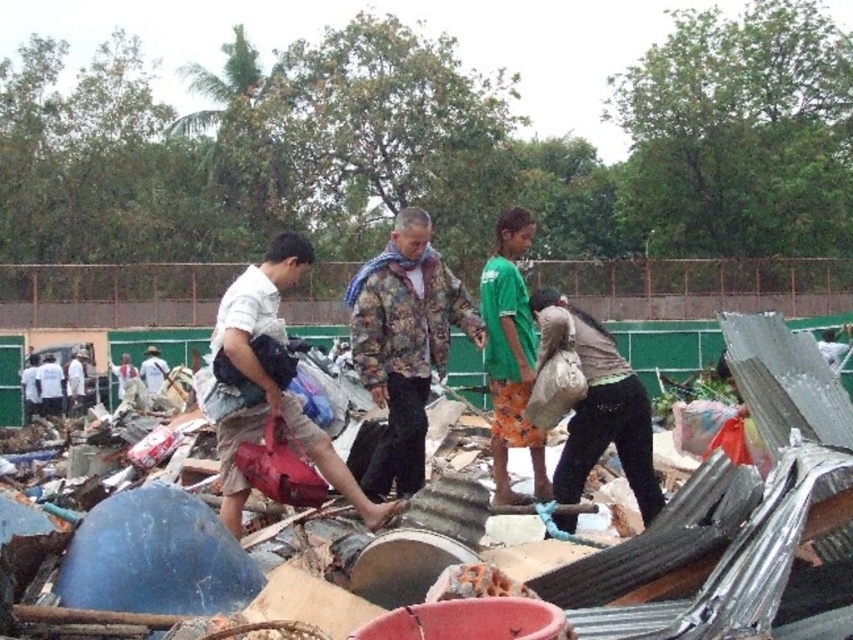
Question: Which is nearer to the brown fabric bag at center?

Choices:
 (A) floral-patterned jacket at center
 (B) white fabric bag at center
 (C) rusty metal debris at center

Answer: (A)

Question: Which point appears farthest from the camera in this image?

Choices:
 (A) (453, 275)
 (B) (546, 483)
 (C) (705, 321)
 (D) (621, 419)

Answer: (C)

Question: Is floral-patterned jacket at center to the left of white fabric bag at center from the viewer's perspective?

Choices:
 (A) yes
 (B) no

Answer: (B)

Question: Is floral-patterned jacket at center to the left of white fabric bag at center from the viewer's perspective?

Choices:
 (A) yes
 (B) no

Answer: (B)

Question: Does floral-patterned jacket at center appear under brown fabric bag at center?

Choices:
 (A) yes
 (B) no

Answer: (A)

Question: Among these points, which one is nearest to the camera?

Choices:
 (A) click(231, 300)
 (B) click(566, 515)

Answer: (A)